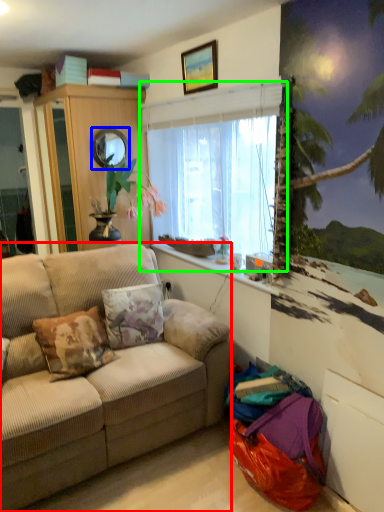
Question: Which object is the closest to the studio couch (highlighted by a red box)? Choose among these: mirror (highlighted by a blue box) or window (highlighted by a green box).

Choices:
 (A) mirror
 (B) window

Answer: (B)